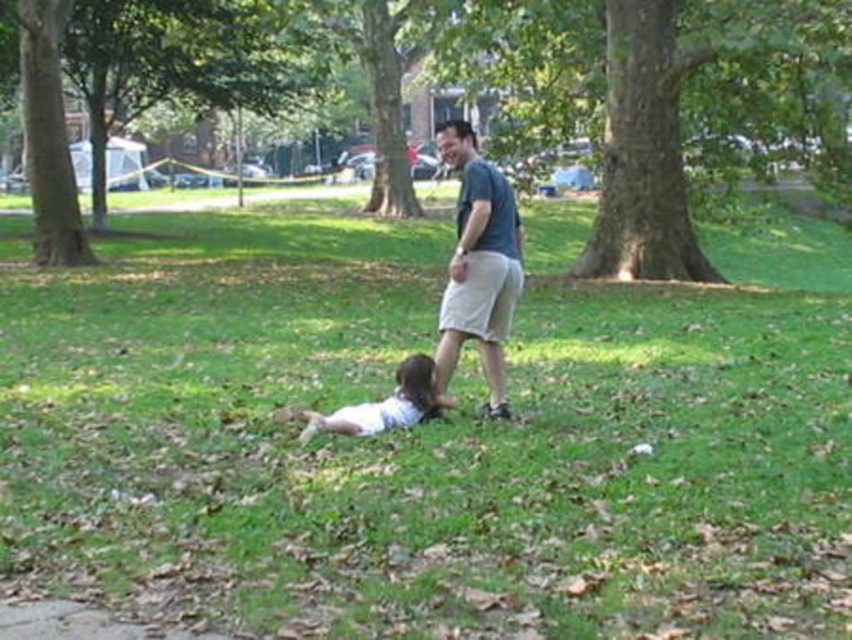
Question: Among these objects, which one is farthest from the camera?

Choices:
 (A) dark blue t-shirt at center
 (B) green grassy at center

Answer: (A)

Question: In this image, where is green grassy at center located relative to dark blue t-shirt at center?

Choices:
 (A) right
 (B) left

Answer: (A)

Question: Is green leafy tree at upper left above white matte shirt at lower center?

Choices:
 (A) no
 (B) yes

Answer: (B)

Question: Based on their relative distances, which object is farther from the green leafy tree at upper left?

Choices:
 (A) green leafy tree at center
 (B) dark blue t-shirt at center

Answer: (B)

Question: Estimate the real-world distances between objects in this image. Which object is farther from the green leafy tree at upper left?

Choices:
 (A) green leafy tree at center
 (B) white matte shirt at lower center
 (C) green grassy at center
 (D) dark blue t-shirt at center

Answer: (B)

Question: Where is dark blue t-shirt at center located in relation to white matte shirt at lower center in the image?

Choices:
 (A) above
 (B) below

Answer: (A)